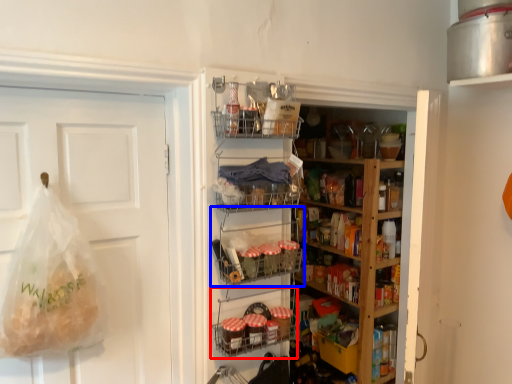
Question: Which point is further to the camera, shelf (highlighted by a red box) or shelf (highlighted by a blue box)?

Choices:
 (A) shelf
 (B) shelf

Answer: (A)